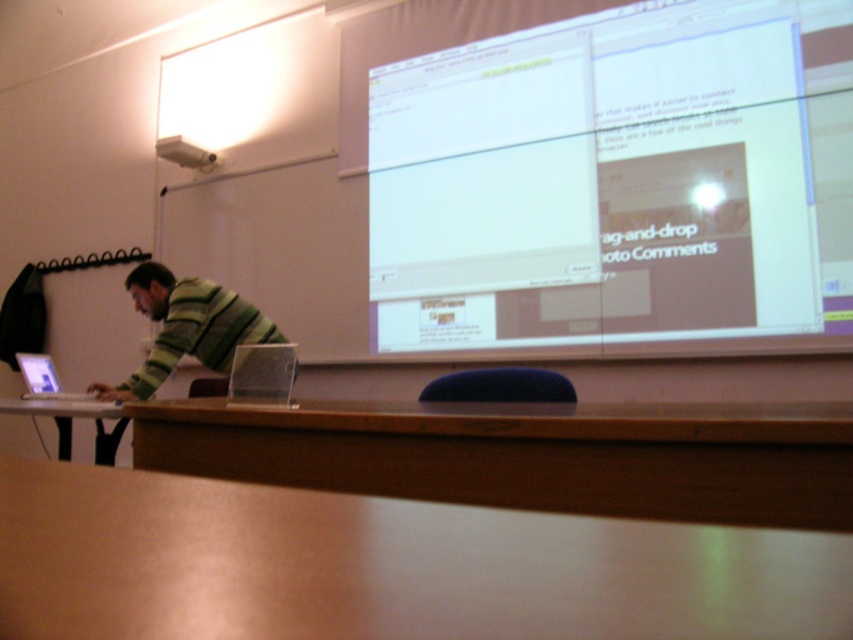
Question: Which point is farther to the camera?

Choices:
 (A) matte silver laptop at left
 (B) silver metallic laptop at left
 (C) white glossy projection screen at upper center

Answer: (B)

Question: Which point appears farthest from the camera in this image?

Choices:
 (A) (79, 412)
 (B) (531, 392)
 (C) (155, 268)
 (D) (485, 113)

Answer: (D)

Question: Can you confirm if white glossy projection screen at upper center is positioned above silver metallic laptop at left?

Choices:
 (A) no
 (B) yes

Answer: (B)

Question: Considering the real-world distances, which object is farthest from the wooden table at lower left?

Choices:
 (A) wooden table at lower center
 (B) brown wooden table at lower center

Answer: (A)

Question: Does blue fabric chair at center come in front of wooden table at lower left?

Choices:
 (A) yes
 (B) no

Answer: (B)

Question: Can you confirm if blue fabric chair at center is positioned above wooden table at lower left?

Choices:
 (A) no
 (B) yes

Answer: (B)